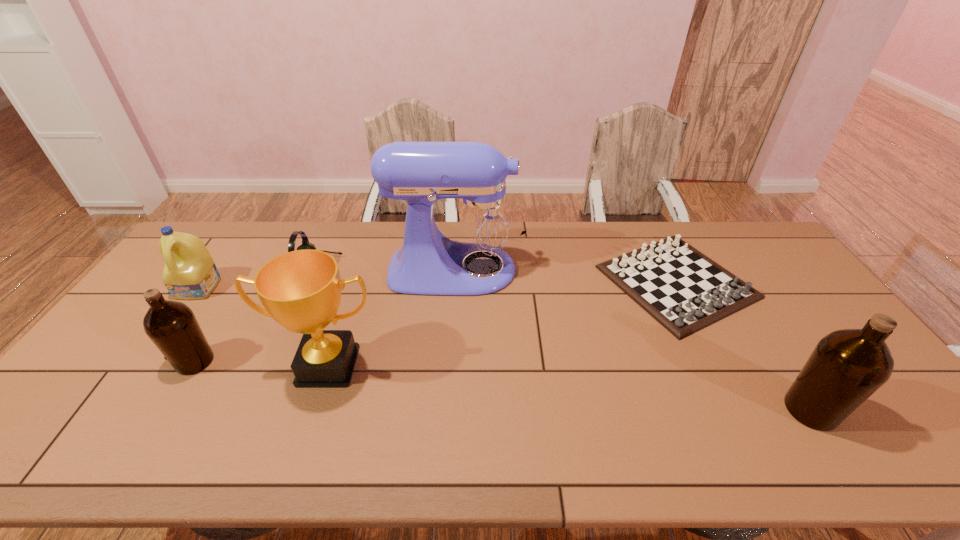
Where is `the sixth object from right to left`? This screenshot has height=540, width=960. the sixth object from right to left is located at coordinates pos(172,326).

The width and height of the screenshot is (960, 540). Identify the location of the left olive oil. (172, 326).

Identify the location of the right olive oil. Image resolution: width=960 pixels, height=540 pixels. (847, 366).

Locate an element on the screen. the taller olive oil is located at coordinates (847, 366).

Where is `mixer`? This screenshot has height=540, width=960. mixer is located at coordinates (482, 224).

The image size is (960, 540). Find the location of `chessboard`. chessboard is located at coordinates (685, 291).

I want to click on the leftmost object, so click(190, 273).

This screenshot has width=960, height=540. In order to click on headset in this screenshot , I will do `click(305, 242)`.

Image resolution: width=960 pixels, height=540 pixels. I want to click on award, so click(301, 290).

Find the location of `free space located 0.060m on the label of the shorter olive oil`. free space located 0.060m on the label of the shorter olive oil is located at coordinates (153, 361).